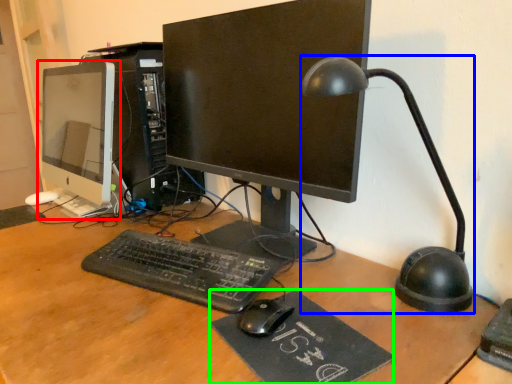
Question: Which is nearer to the computer monitor (highlighted by a red box)? table lamp (highlighted by a blue box) or mousepad (highlighted by a green box).

Choices:
 (A) table lamp
 (B) mousepad

Answer: (A)